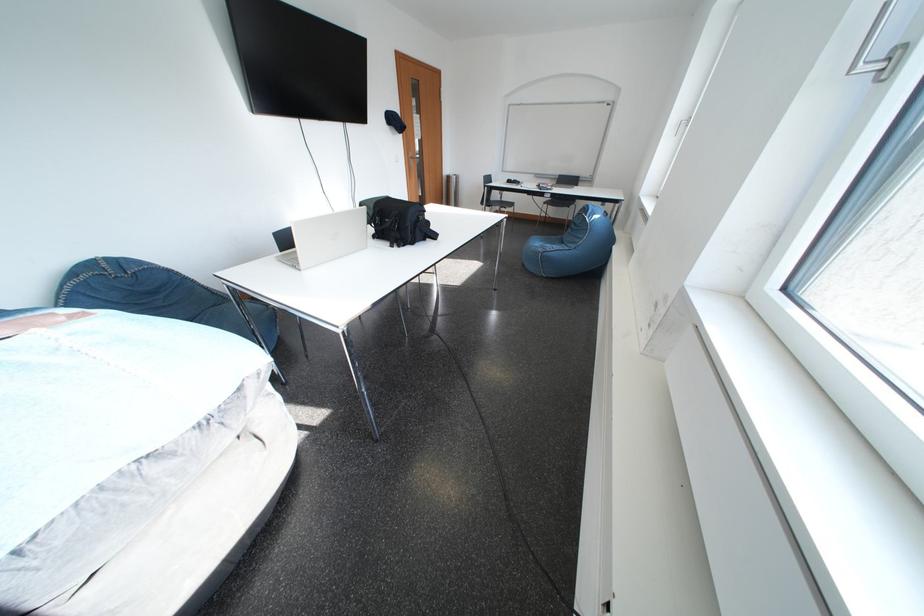
Where would you lift the white laptop? Please return your answer as a coordinate pair (x, y).

(325, 238)